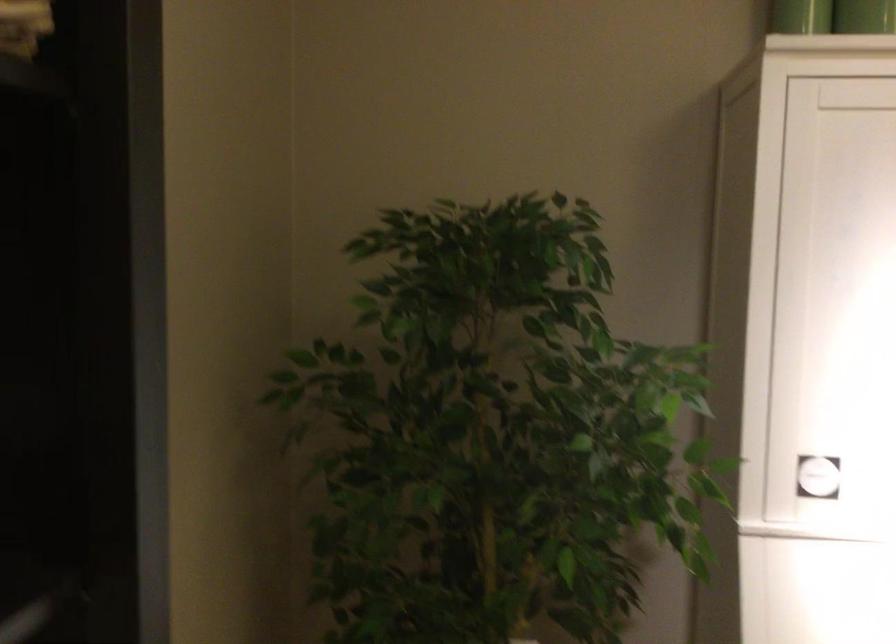
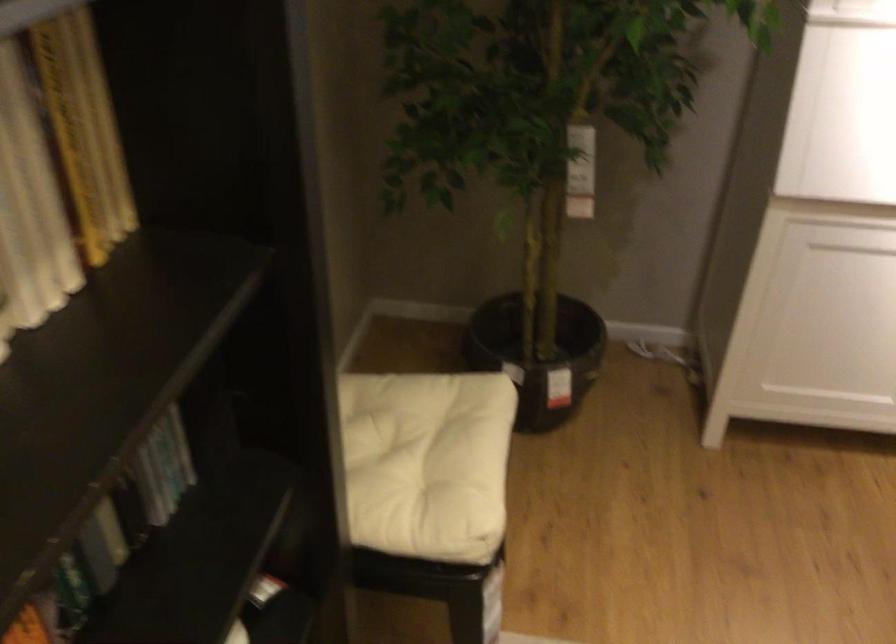
Question: The first image is from the beginning of the video and the second image is from the end. How did the camera likely rotate when shooting the video?

Choices:
 (A) Left
 (B) Right
 (C) Up
 (D) Down

Answer: (D)